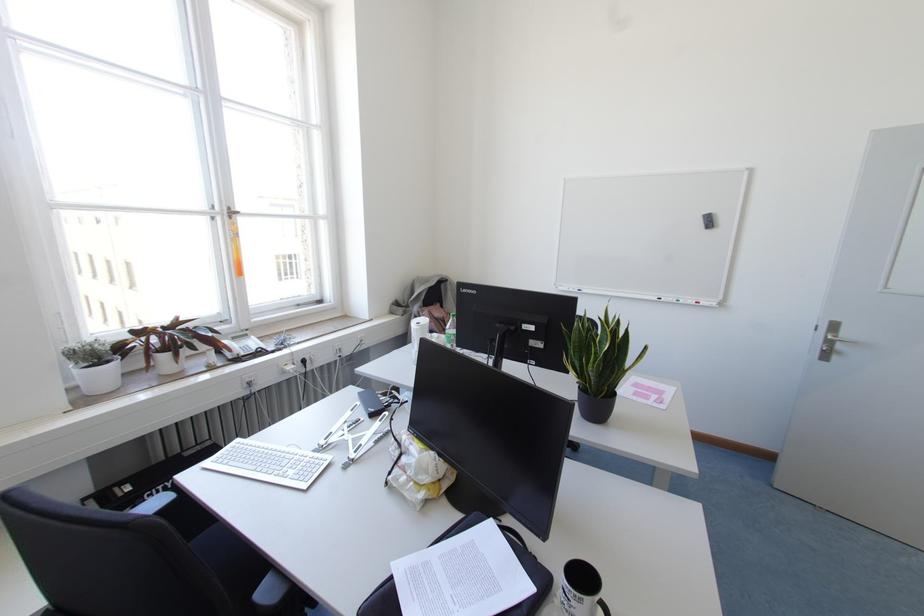
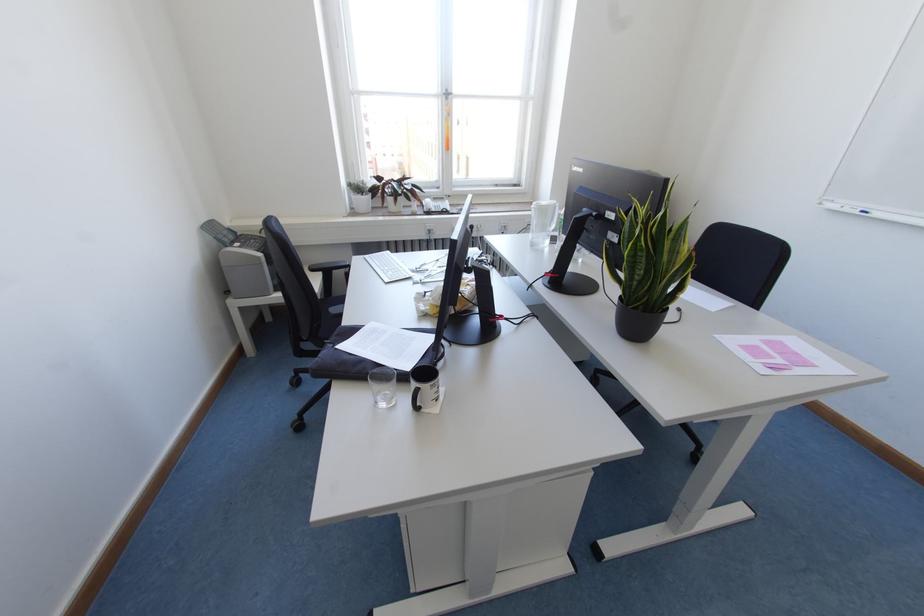
The images are taken continuously from a first-person perspective. In which direction is your viewpoint rotating?

The camera's rotation is toward left-down.